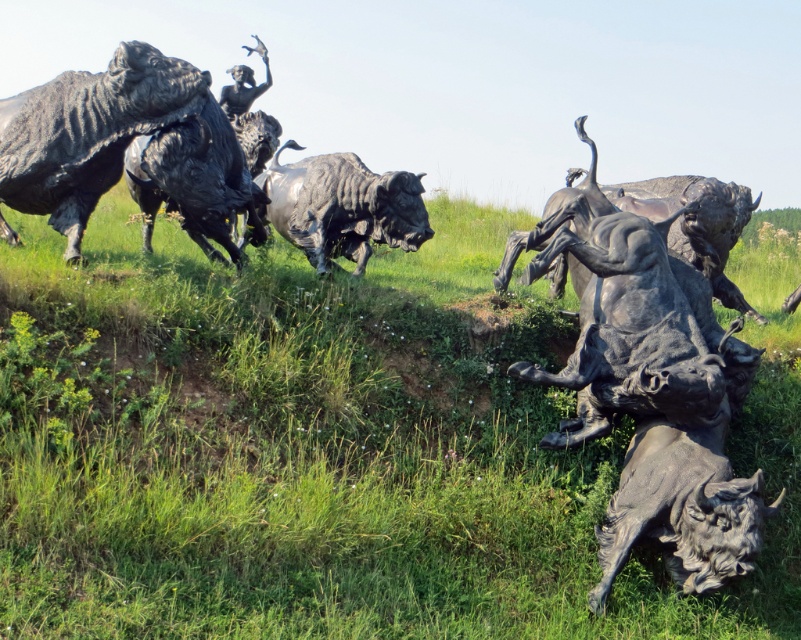
Is point (659, 310) positioned after point (288, 241)?

No, it is not.

You are a GUI agent. You are given a task and a screenshot of the screen. Output one action in this format:
    pyautogui.click(x=<x>, y=<y>)
    Task: Click on the bronze textured bison at center
    
    Given the screenshot: What is the action you would take?
    (650, 388)

Where is `bronze textured bison at center`? bronze textured bison at center is located at coordinates 650,388.

Describe the element at coordinates (337, 445) in the screenshot. I see `green grass at center` at that location.

Locate an element on the screen. Image resolution: width=801 pixels, height=640 pixels. green grass at center is located at coordinates (337, 445).

Who is more forward, (385, 291) or (723, 481)?

Positioned in front is point (723, 481).

Between green grass at center and bronze textured bison at center, which one has less height?

Standing shorter between the two is green grass at center.

What do you see at coordinates (337, 445) in the screenshot?
I see `green grass at center` at bounding box center [337, 445].

Where is `green grass at center`? green grass at center is located at coordinates (337, 445).